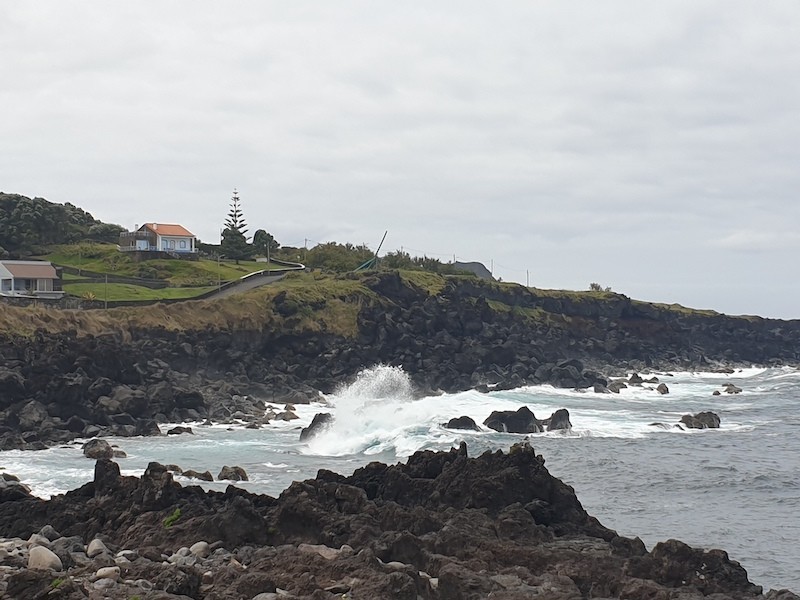
Find the location of a particular element. wall is located at coordinates (102, 305), (100, 276), (150, 285), (240, 281), (293, 268).